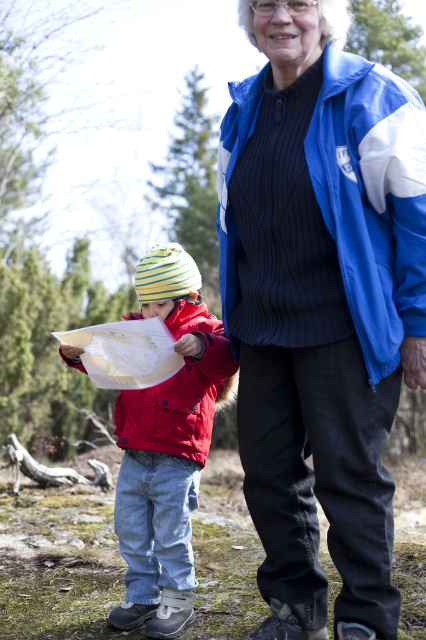
Is blue fabric jacket at upper right smaller than matte red jacket at lower left?

Indeed, blue fabric jacket at upper right has a smaller size compared to matte red jacket at lower left.

Can you confirm if blue fabric jacket at upper right is positioned to the right of matte red jacket at lower left?

Indeed, blue fabric jacket at upper right is positioned on the right side of matte red jacket at lower left.

Between point (385, 321) and point (215, 387), which one is positioned in front?

Point (385, 321)

Where is `blue fabric jacket at upper right`? blue fabric jacket at upper right is located at coordinates (373, 198).

Who is lower down, matte red jacket at left or matte red jacket at lower left?

matte red jacket at left

Between matte red jacket at left and matte red jacket at lower left, which one has more height?

Standing taller between the two is matte red jacket at left.

The width and height of the screenshot is (426, 640). Identify the location of matte red jacket at left. (166, 445).

Can you confirm if blue fabric jacket at upper right is taller than matte red jacket at left?

No.

What do you see at coordinates (373, 198) in the screenshot?
I see `blue fabric jacket at upper right` at bounding box center [373, 198].

At what (x,y) coordinates should I click in order to perform the action: click on blue fabric jacket at upper right. Please return your answer as a coordinate pair (x, y). Looking at the image, I should click on (373, 198).